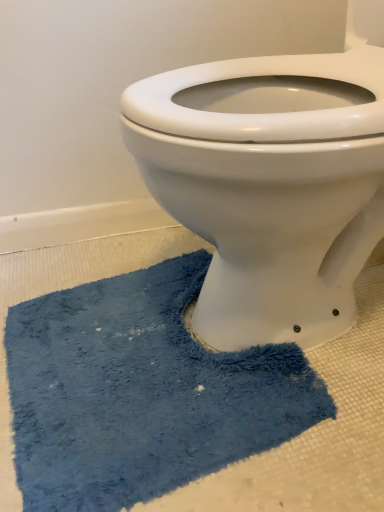
Question: From the image's perspective, is blue fuzzy bath mat at lower center located above or below white glossy porcelain toilet at center?

Choices:
 (A) below
 (B) above

Answer: (A)

Question: In terms of height, does blue fuzzy bath mat at lower center look taller or shorter compared to white glossy porcelain toilet at center?

Choices:
 (A) short
 (B) tall

Answer: (A)

Question: Is blue fuzzy bath mat at lower center in front of or behind white glossy porcelain toilet at center in the image?

Choices:
 (A) behind
 (B) front

Answer: (A)

Question: From a real-world perspective, relative to blue fuzzy bath mat at lower center, is white glossy porcelain toilet at center vertically above or below?

Choices:
 (A) below
 (B) above

Answer: (B)

Question: Choose the correct answer: Is white glossy porcelain toilet at center inside blue fuzzy bath mat at lower center or outside it?

Choices:
 (A) outside
 (B) inside

Answer: (A)

Question: Would you say white glossy porcelain toilet at center is to the left or to the right of blue fuzzy bath mat at lower center in the picture?

Choices:
 (A) right
 (B) left

Answer: (A)

Question: Is point (322, 74) positioned closer to the camera than point (125, 470)?

Choices:
 (A) farther
 (B) closer

Answer: (A)